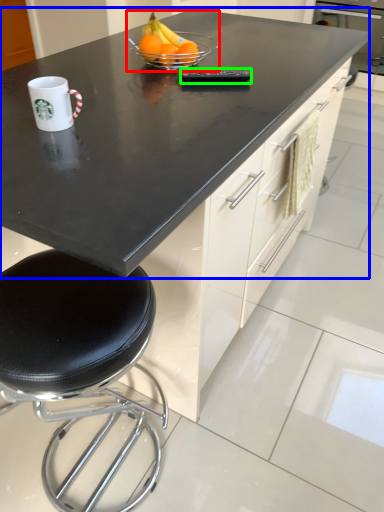
Question: Considering the real-world distances, which object is closest to fruit dish (highlighted by a red box)? countertop (highlighted by a blue box) or appliance (highlighted by a green box).

Choices:
 (A) countertop
 (B) appliance

Answer: (B)